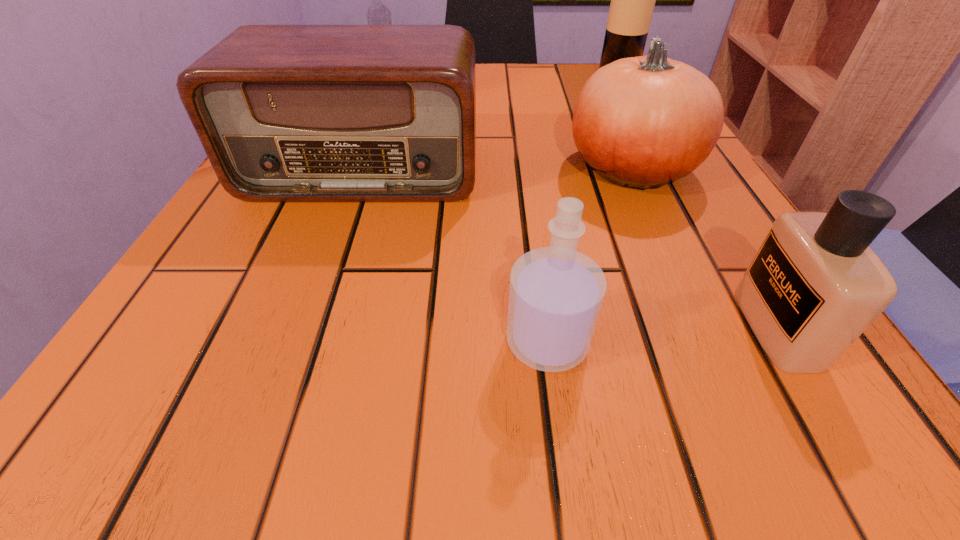
Locate an element on the screen. free space between the tallest object and the radio receiver is located at coordinates (491, 123).

The width and height of the screenshot is (960, 540). What are the coordinates of `free area in between the right perfume and the pumpkin` in the screenshot? It's located at [x=705, y=248].

At what (x,y) coordinates should I click in order to perform the action: click on free area in between the tallest object and the radio receiver. Please return your answer as a coordinate pair (x, y). The width and height of the screenshot is (960, 540). Looking at the image, I should click on (491, 123).

Identify the location of vacant area that lies between the tallest object and the radio receiver. (491, 123).

At what (x,y) coordinates should I click in order to perform the action: click on vacant area that lies between the tallest object and the right perfume. Please return your answer as a coordinate pair (x, y). The height and width of the screenshot is (540, 960). Looking at the image, I should click on (697, 201).

This screenshot has width=960, height=540. Find the location of `free point between the wine bottle and the radio receiver`. free point between the wine bottle and the radio receiver is located at coordinates (491, 123).

Identify which object is located as the fourth nearest to the vodka. Please provide its 2D coordinates. Your answer should be formatted as a tuple, i.e. [(x, y)], where the tuple contains the x and y coordinates of a point satisfying the conditions above.

[(556, 293)]

Where is `object that is the third closest to the vodka`? This screenshot has width=960, height=540. object that is the third closest to the vodka is located at coordinates (632, 4).